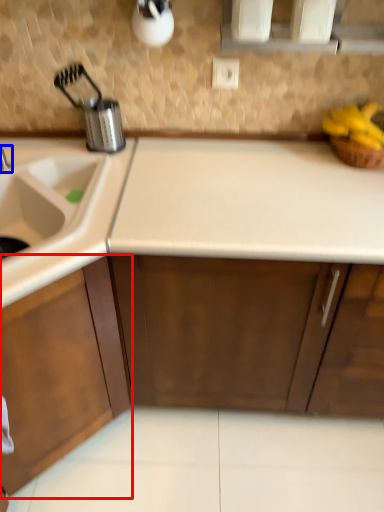
Question: Which object is further to the camera taking this photo, cabinetry (highlighted by a red box) or tap (highlighted by a blue box)?

Choices:
 (A) cabinetry
 (B) tap

Answer: (B)